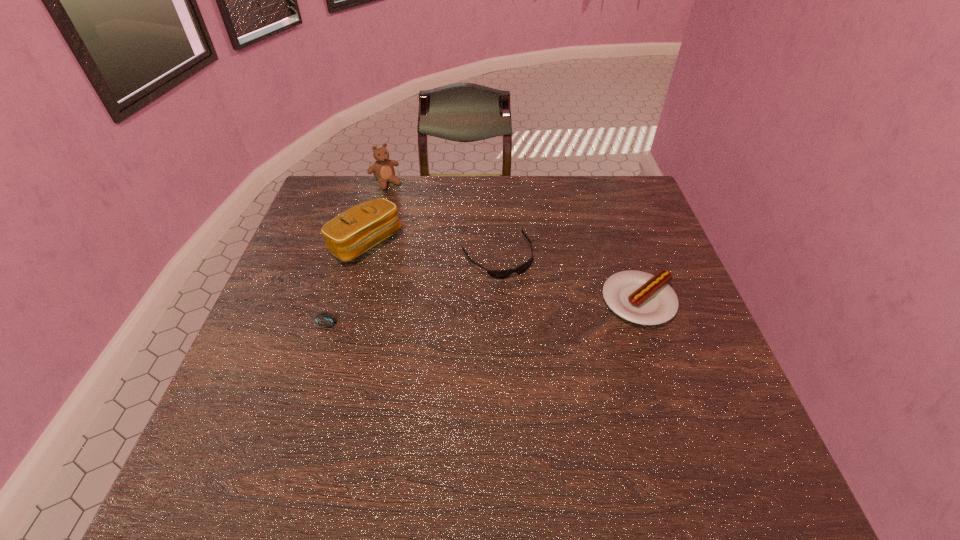
Find the location of `empty space between the second tallest object and the shortest object`. empty space between the second tallest object and the shortest object is located at coordinates (351, 285).

The height and width of the screenshot is (540, 960). Identify the location of vacant region between the shortest object and the sunglasses. (417, 292).

You are a GUI agent. You are given a task and a screenshot of the screen. Output one action in this format:
    pyautogui.click(x=<x>, y=<y>)
    Task: Click on the vacant area that lies between the teddy bear and the fourth tallest object
    
    Given the screenshot: What is the action you would take?
    pyautogui.click(x=442, y=220)

Identify the location of vacant point located between the clutch bag and the mouse. The image size is (960, 540). (351, 285).

This screenshot has height=540, width=960. Find the location of `free space between the tallest object and the second object from right to left`. free space between the tallest object and the second object from right to left is located at coordinates (442, 220).

This screenshot has width=960, height=540. Find the location of `vacant space that's between the clutch bag and the sunglasses`. vacant space that's between the clutch bag and the sunglasses is located at coordinates (431, 251).

Where is `blank region between the fourth shortest object and the shortest object`? This screenshot has height=540, width=960. blank region between the fourth shortest object and the shortest object is located at coordinates (351, 285).

Where is `free space between the sunglasses and the second tallest object`? The image size is (960, 540). free space between the sunglasses and the second tallest object is located at coordinates click(431, 251).

Identify which object is the closest to the sunglasses. Please provide its 2D coordinates. Your answer should be formatted as a tuple, i.e. [(x, y)], where the tuple contains the x and y coordinates of a point satisfying the conditions above.

[(639, 297)]

Image resolution: width=960 pixels, height=540 pixels. Identify the location of object that stands as the third closest to the shortest object. (383, 169).